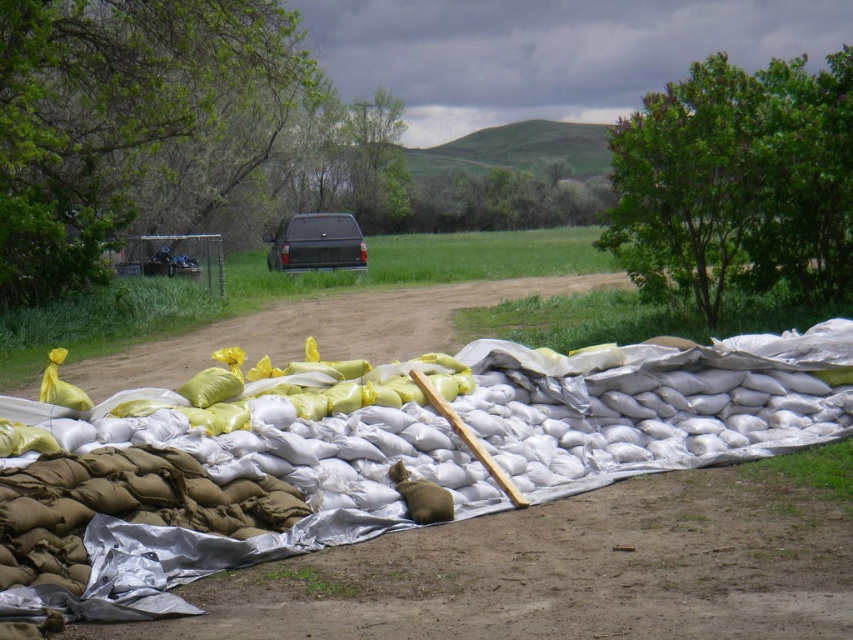
You are a delivery driver who needs to park your truck near the white sandbags at center. Based on the scene, can your truck fit in the space where the matte black truck at center is currently parked?

The white sandbags at center occupies less space than matte black truck at center, so the space where the matte black truck at center is parked is larger. Therefore, your truck can fit in that space.

You are standing at the point marked by the coordinates point [209,492]. Looking around, you see the white sandbags at center. Which direction should you move to reach the wooden plank lying horizontally across the top of the sandbag pile?

The wooden plank is located on the top of the sandbag pile where the point [209,492] marks the white sandbags at center. To reach the wooden plank, you should move upward from the point towards the top of the sandbag pile.

You are standing at the edge of the dirt road and want to place a new white sandbag exactly where the existing white sandbags at center are located. According to the coordinates provided, where should you place the new white sandbag?

You should place the new white sandbag at the coordinates point (209, 492) where the existing white sandbags at center are located.